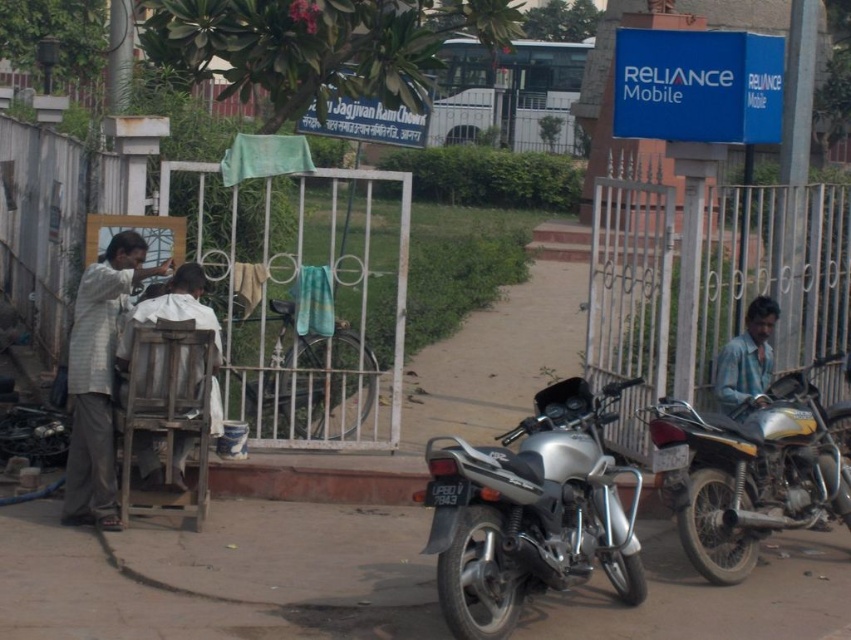
Question: Among these objects, which one is nearest to the camera?

Choices:
 (A) light gray striped shirt at left
 (B) brown matte hair at upper left
 (C) dark brown hair at center
 (D) metallic gate at right

Answer: (A)

Question: Which object is closer to the camera taking this photo?

Choices:
 (A) dark brown hair at center
 (B) metallic gate at right
 (C) short brown hair at center
 (D) silver metallic motorcycle at center

Answer: (D)

Question: Can you confirm if silver metallic motorcycle at center is positioned above silver metallic motorcycle at right?

Choices:
 (A) no
 (B) yes

Answer: (A)

Question: Which point is closer to the camera taking this photo?

Choices:
 (A) (566, 524)
 (B) (141, 248)
 (C) (831, 470)

Answer: (A)

Question: Is metallic gate at right in front of silver metallic motorcycle at right?

Choices:
 (A) yes
 (B) no

Answer: (B)

Question: From the image, what is the correct spatial relationship of silver metallic motorcycle at right in relation to light gray striped shirt at left?

Choices:
 (A) left
 (B) right

Answer: (B)